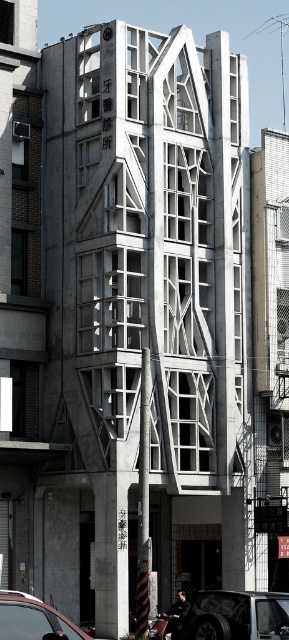
You are a delivery person trying to park your vehicle in a narrow alley next to the black matte car at center and the metallic silver car at lower left. The alley has a height restriction of 1.8 meters. Can both cars fit under this restriction?

The black matte car at center has a greater height compared to metallic silver car at lower left. If the black matte car at center exceeds the 1.8 meters height restriction, then both cars cannot fit. However, if the black matte car at center is under 1.8 meters, then both can fit.

You are a parking attendant who needs to park a new car in the lot. The new car is 2 meters wide. There are two existing cars in the image, a black matte car at center and a metallic silver car at lower left. Can you determine if the space between them is wide enough to accommodate the new car?

The black matte car at center might be wider than metallic silver car at lower left, so the space between them might not be wide enough for the new car which is 2 meters wide. It is uncertain without exact measurements.

You are standing at point A at the base of the building. There is a point B located at point (230, 621). You want to move from point A to point B. The distance between them is 126.02 feet. If you can walk at a speed of 3 feet per second, how many seconds will it take you to reach point B?

The distance between point A and point (230, 621) is 126.02 feet. At a walking speed of 3 feet per second, it will take 126.02 divided by 3, which is approximately 42.01 seconds to reach point B.